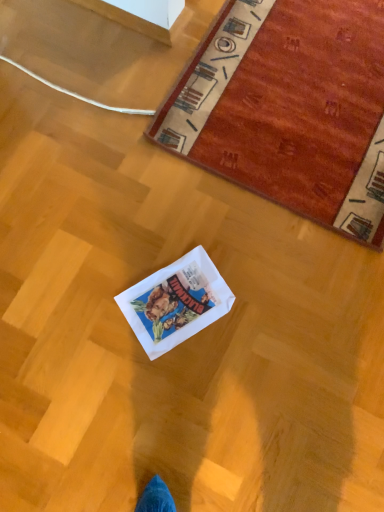
This screenshot has height=512, width=384. I want to click on blank space situated above white paper bag at center (from a real-world perspective), so click(180, 303).